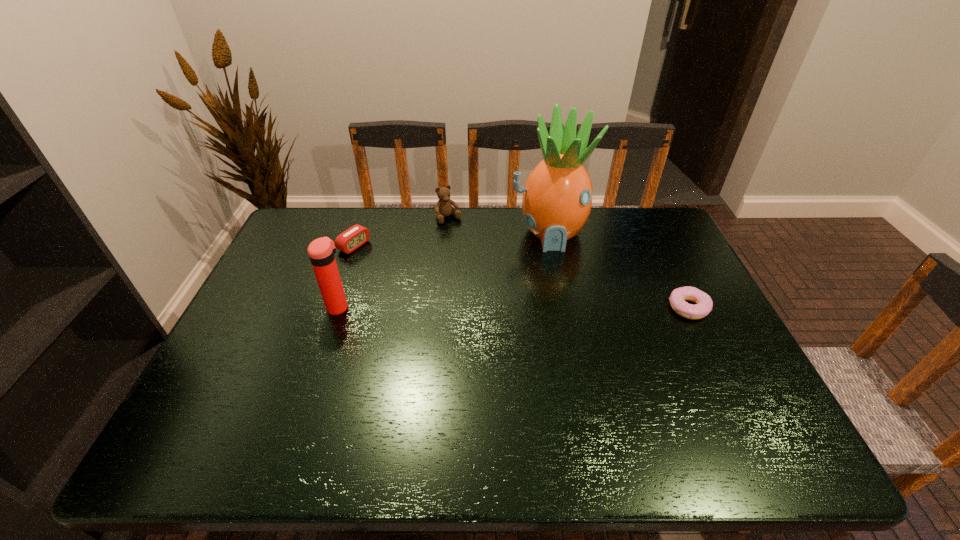
The width and height of the screenshot is (960, 540). I want to click on free space located 0.060m at the entrance of the second object from right to left, so click(x=557, y=268).

The height and width of the screenshot is (540, 960). In order to click on free point located at the entrance of the second object from right to left in this screenshot , I will do `click(569, 331)`.

Identify the location of vacant space located at the entrance of the second object from right to left. The image size is (960, 540). (564, 303).

Where is `vacant space located 0.370m on the front-facing side of the third object from left to right`? Image resolution: width=960 pixels, height=540 pixels. vacant space located 0.370m on the front-facing side of the third object from left to right is located at coordinates (503, 293).

Identify the location of free spot located on the front-facing side of the third object from left to right. (477, 256).

This screenshot has width=960, height=540. Find the location of `free location located on the front-facing side of the third object from left to right`. free location located on the front-facing side of the third object from left to right is located at coordinates (487, 270).

This screenshot has height=540, width=960. Identify the location of free space located on the front-facing side of the alarm clock. (385, 262).

Find the location of a particular element. free location located on the front-facing side of the alarm clock is located at coordinates (410, 274).

The width and height of the screenshot is (960, 540). I want to click on vacant space located on the front-facing side of the alarm clock, so click(x=420, y=280).

I want to click on pineapple present at the far edge, so click(557, 198).